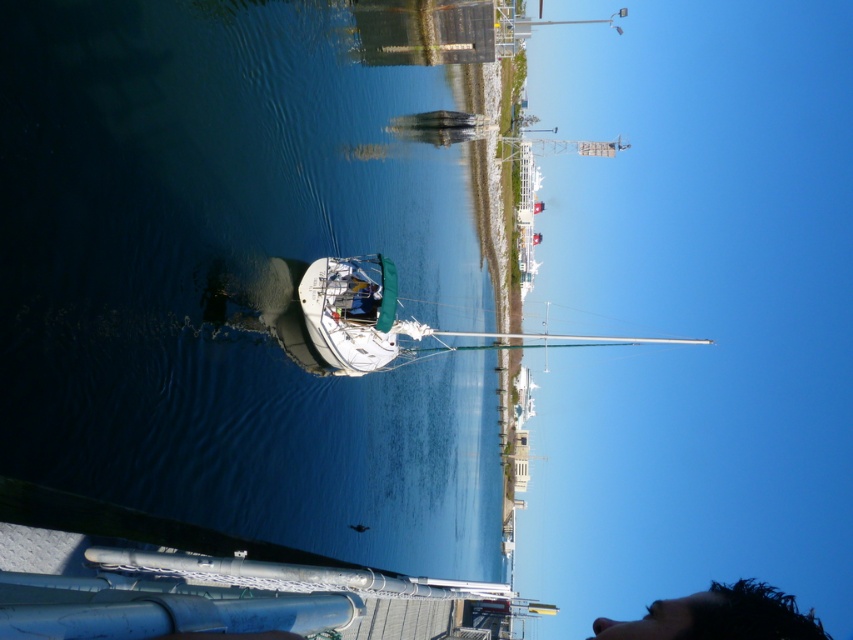
Looking at this image, does white glossy water at center appear under white glossy sailboat at center?

Incorrect, white glossy water at center is not positioned below white glossy sailboat at center.

Who is positioned more to the right, white glossy water at center or white glossy sailboat at center?

white glossy water at center

Is point (229, 29) in front of point (392, 275)?

Yes, point (229, 29) is closer to viewer.

This screenshot has width=853, height=640. I want to click on white glossy water at center, so click(235, 280).

Looking at this image, which of these two, white glossy sailboat at center or black hair at lower right, stands shorter?

white glossy sailboat at center is shorter.

Is point (312, 326) farther from camera compared to point (720, 600)?

Yes, point (312, 326) is farther from viewer.

What do you see at coordinates (352, 312) in the screenshot?
I see `white glossy sailboat at center` at bounding box center [352, 312].

Identify the location of white glossy sailboat at center. (352, 312).

Who is higher up, white glossy water at center or black hair at lower right?

white glossy water at center is higher up.

Can you confirm if white glossy water at center is bigger than black hair at lower right?

Actually, white glossy water at center might be smaller than black hair at lower right.

Which is behind, point (286, 35) or point (799, 618)?

Positioned behind is point (286, 35).

This screenshot has height=640, width=853. I want to click on white glossy water at center, so click(x=235, y=280).